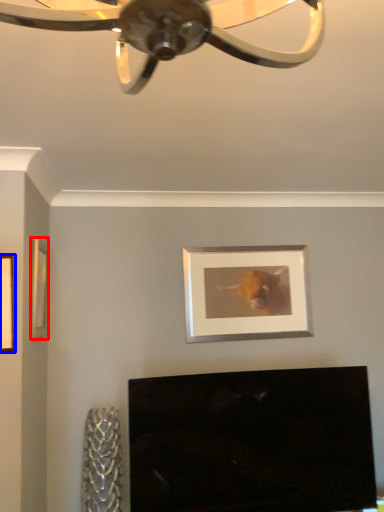
Question: Which object appears closest to the camera in this image, picture frame (highlighted by a red box) or picture frame (highlighted by a blue box)?

Choices:
 (A) picture frame
 (B) picture frame

Answer: (B)